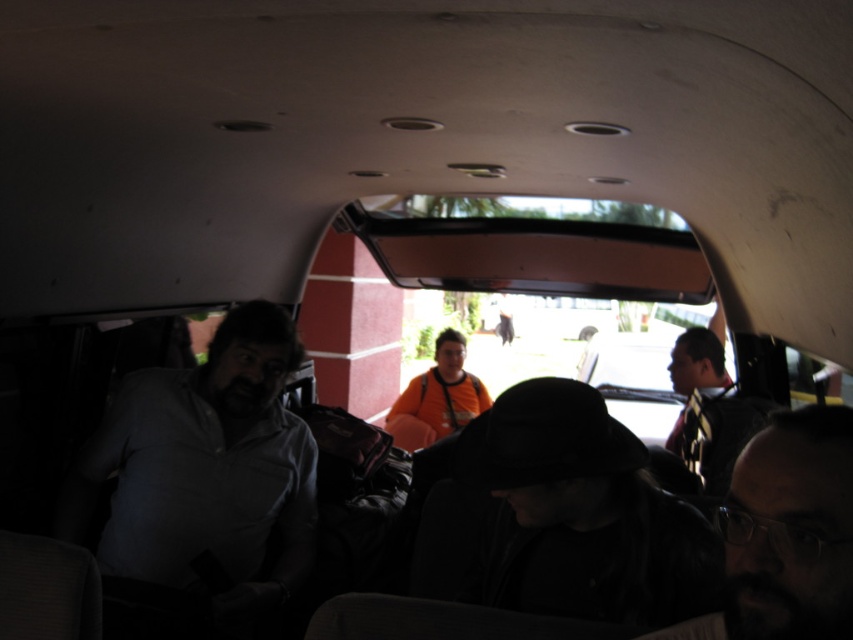
You are a delivery robot with a package that needs to navigate between the matte gray shirt at left and the dark hair at lower right in the vehicle. The robot requires a minimum of 1.5 meters of space to pass safely. Based on the scene, can the robot safely navigate through this space?

The matte gray shirt at left and dark hair at lower right are 1.42 meters apart from each other. Since the required minimum space for the robot is 1.5 meters, the distance is insufficient. The robot cannot safely navigate through this space.